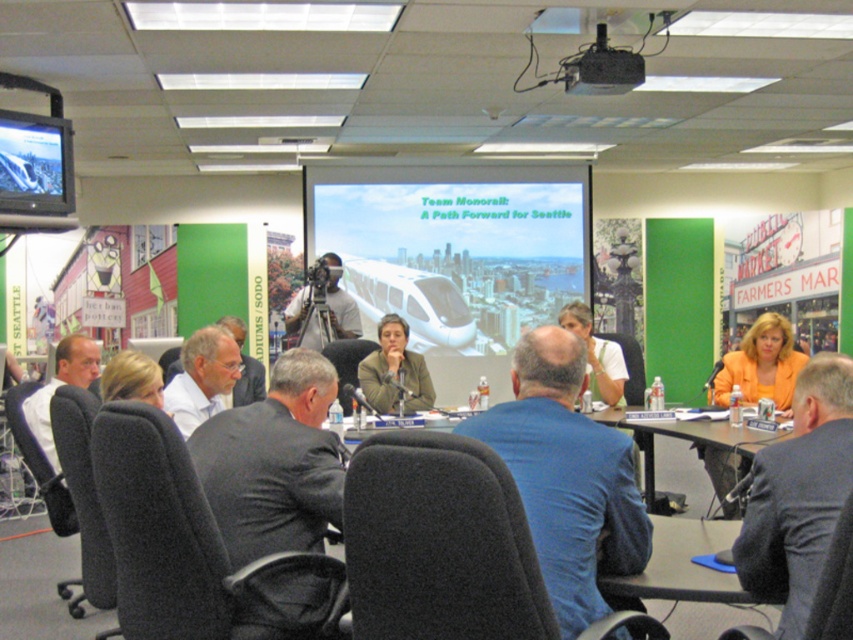
You are an event organizer who needs to adjust the projector to ensure the presentation is visible to all attendees. Considering the black plastic projector at upper center and the matte white shirt at center, which object is shorter and requires you to position the projector closer to the screen?

The black plastic projector at upper center has a lesser height compared to the matte white shirt at center, so you should position the projector closer to the screen to ensure proper focus and visibility.

You are a photographer setting up for a group photo at the conference table. You need to ensure that both the blue fabric jacket at center and the matte gray blazer at center are fully visible in the frame. Based on their positions and sizes, is there a risk that one might block the other?

The blue fabric jacket at center might be wider than matte gray blazer at center, so there is a risk that the blue fabric jacket at center could block part of the matte gray blazer at center if they are positioned closely together.